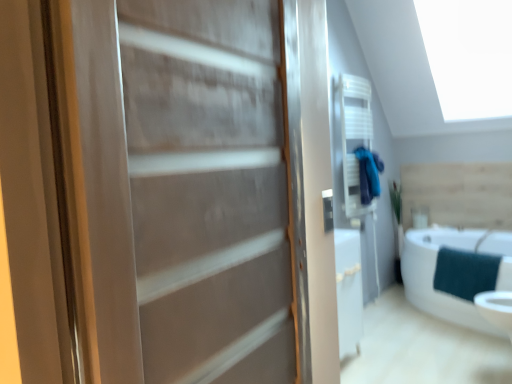
Question: Is teal fabric bathrobe at upper right looking in the opposite direction of teal fabric towel at lower right?

Choices:
 (A) yes
 (B) no

Answer: (B)

Question: Is teal fabric bathrobe at upper right directly adjacent to teal fabric towel at lower right?

Choices:
 (A) no
 (B) yes

Answer: (A)

Question: Considering the relative positions of teal fabric bathrobe at upper right and teal fabric towel at lower right in the image provided, is teal fabric bathrobe at upper right to the right of teal fabric towel at lower right from the viewer's perspective?

Choices:
 (A) yes
 (B) no

Answer: (B)

Question: Can you confirm if teal fabric bathrobe at upper right is wider than teal fabric towel at lower right?

Choices:
 (A) yes
 (B) no

Answer: (B)

Question: From the image's perspective, would you say teal fabric bathrobe at upper right is positioned over teal fabric towel at lower right?

Choices:
 (A) yes
 (B) no

Answer: (A)

Question: Considering the positions of teal fabric towel at lower right and teal fabric bathrobe at upper right in the image, is teal fabric towel at lower right bigger or smaller than teal fabric bathrobe at upper right?

Choices:
 (A) big
 (B) small

Answer: (A)

Question: From the image's perspective, relative to teal fabric bathrobe at upper right, is teal fabric towel at lower right above or below?

Choices:
 (A) below
 (B) above

Answer: (A)

Question: In the image, is teal fabric towel at lower right on the left side or the right side of teal fabric bathrobe at upper right?

Choices:
 (A) right
 (B) left

Answer: (A)

Question: Relative to teal fabric bathrobe at upper right, is teal fabric towel at lower right in front or behind?

Choices:
 (A) front
 (B) behind

Answer: (A)

Question: Is point (463, 279) positioned closer to the camera than point (133, 238)?

Choices:
 (A) farther
 (B) closer

Answer: (A)

Question: Visually, is teal fabric towel at lower right positioned to the left or to the right of matte wood door at center?

Choices:
 (A) left
 (B) right

Answer: (B)

Question: Looking at their shapes, would you say teal fabric towel at lower right is wider or thinner than matte wood door at center?

Choices:
 (A) thin
 (B) wide

Answer: (B)

Question: From a real-world perspective, is teal fabric towel at lower right positioned above or below matte wood door at center?

Choices:
 (A) above
 (B) below

Answer: (B)

Question: From the image's perspective, is matte wood door at center positioned above or below teal fabric towel at lower right?

Choices:
 (A) below
 (B) above

Answer: (B)

Question: In terms of height, does matte wood door at center look taller or shorter compared to teal fabric towel at lower right?

Choices:
 (A) tall
 (B) short

Answer: (A)